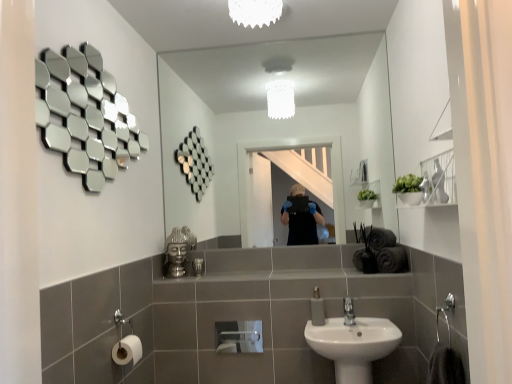
What are the coordinates of `free space in front of white matte soap dispenser at lower center` in the screenshot? It's located at (330, 329).